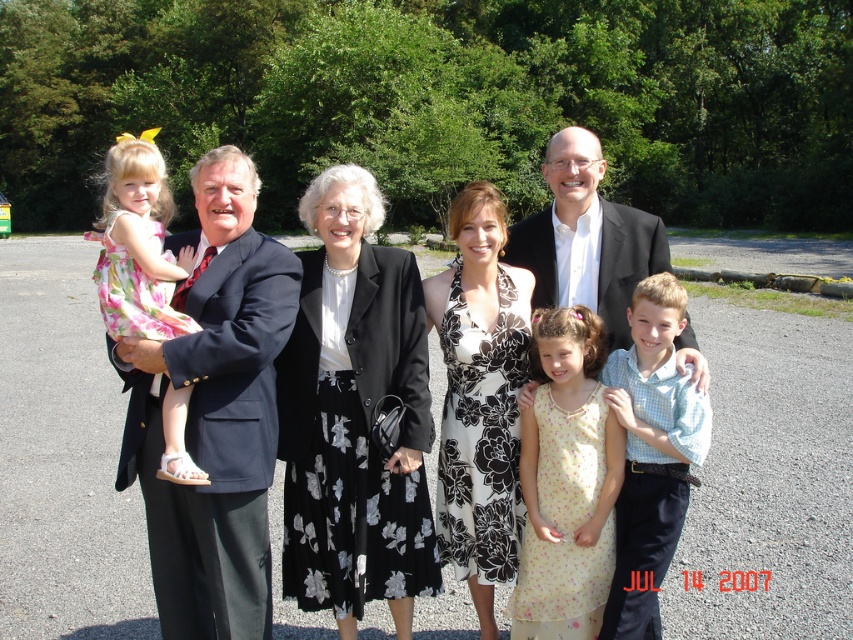
Question: Where is floral dress at center located in relation to yellow floral dress at center in the image?

Choices:
 (A) left
 (B) right

Answer: (A)

Question: Estimate the real-world distances between objects in this image. Which object is farther from the light blue checkered shirt at center?

Choices:
 (A) black floral dress at center
 (B) matte black suit at left
 (C) floral dress at center
 (D) pink floral dress at left

Answer: (D)

Question: Does matte black suit at left appear on the left side of black floral dress at center?

Choices:
 (A) no
 (B) yes

Answer: (B)

Question: Which object is farther from the camera taking this photo?

Choices:
 (A) yellow floral dress at center
 (B) matte black suit at left

Answer: (A)

Question: Is black floral skirt at center bigger than pink floral dress at left?

Choices:
 (A) yes
 (B) no

Answer: (B)

Question: Which of the following is the farthest from the observer?

Choices:
 (A) (444, 364)
 (B) (198, 483)

Answer: (A)